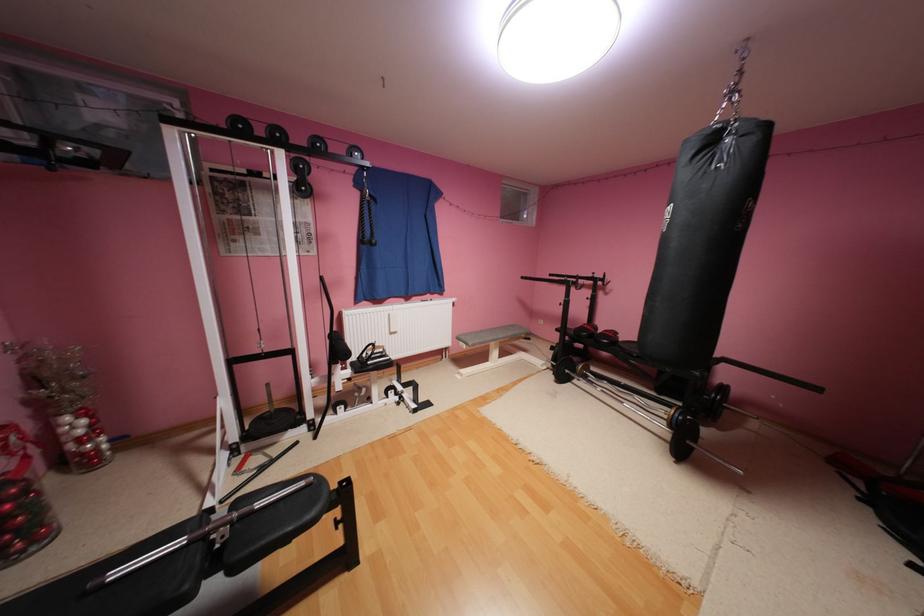
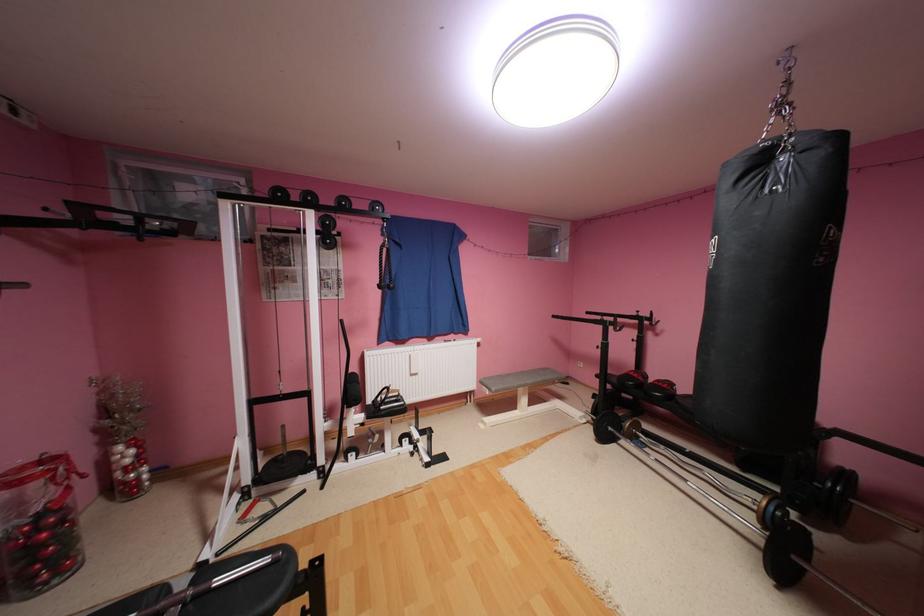
Find the pixel in the second image that matches (242,437) in the first image.

(256, 479)